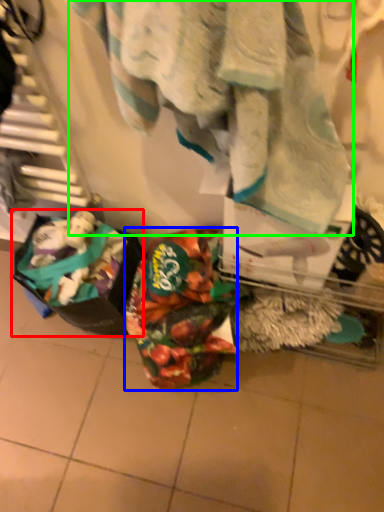
Question: Based on their relative distances, which object is farther from waste (highlighted by a red box)? Choose from waste (highlighted by a blue box) and towel (highlighted by a green box).

Choices:
 (A) waste
 (B) towel

Answer: (B)